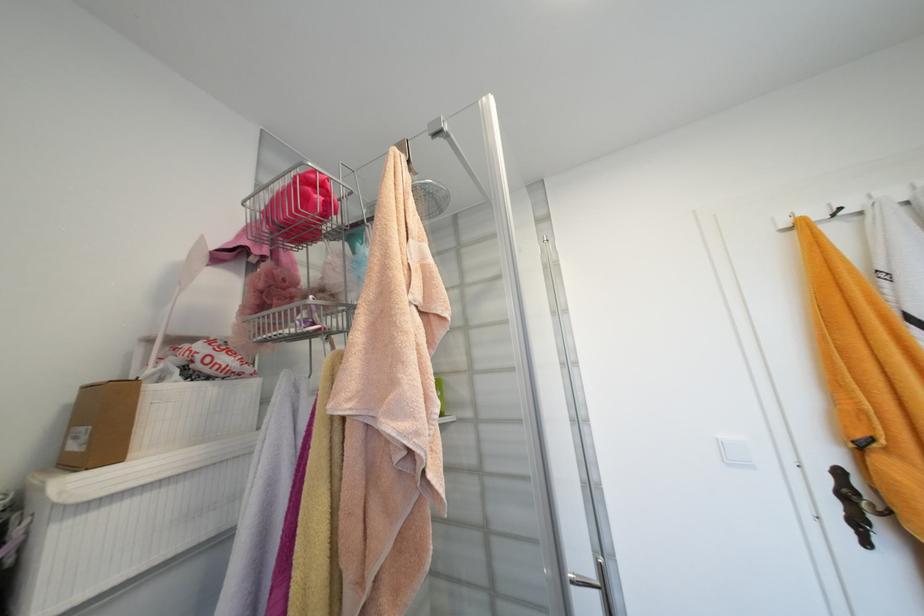
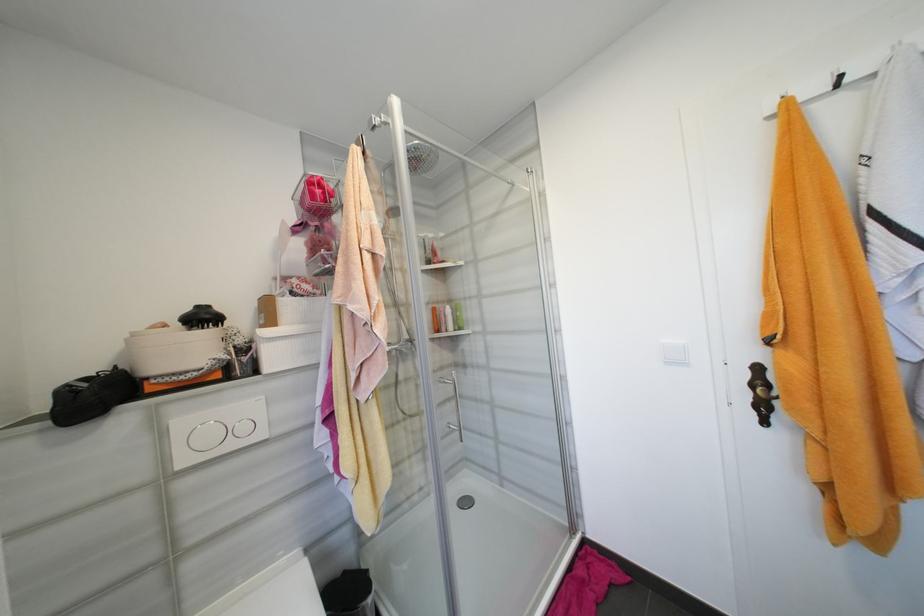
In the second image, find the point that corresponds to pixel 845 474 in the first image.

(763, 370)